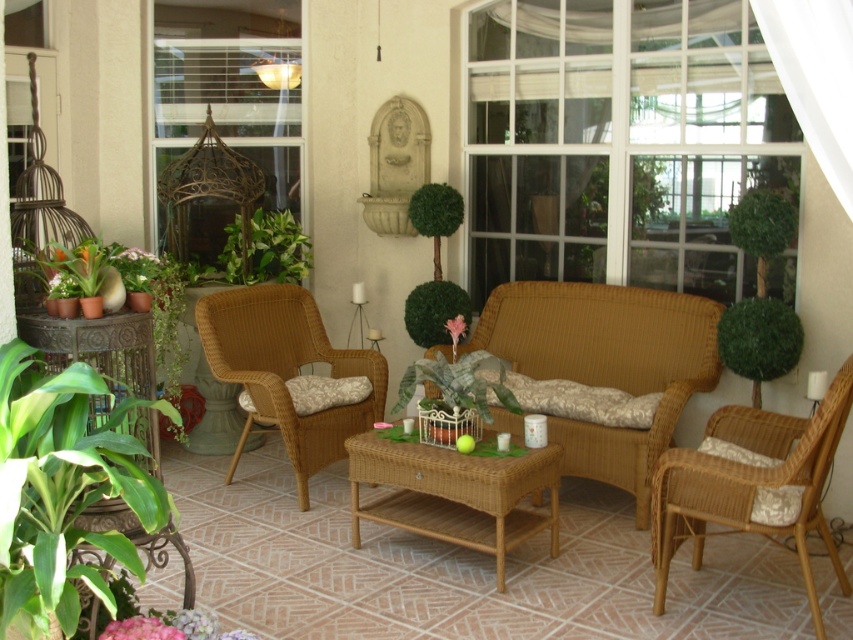
You are standing at the entrance of the sunroom and want to move to the woven wicker armchair at right. Based on the 2D coordinates provided, in which general direction should you walk from your current position?

The woven wicker armchair at right is located at coordinates approximately 0.756 on the x axis and 0.882 on the y axis. Since you are at the entrance, which is typically positioned at the lower left corner of a room, you should walk towards the upper right direction to reach the woven wicker armchair at right.

Based on the photo, you are planning to place a small table between the green wicker basket at center and the green leafy bush at center. The table requires 1.2 meters of space. Based on the scene description, will there be enough space to fit the table between them?

The distance between the green wicker basket at center and the green leafy bush at center is 1.14 meters. Since the table requires 1.2 meters of space, there is not enough room to fit the table between them.